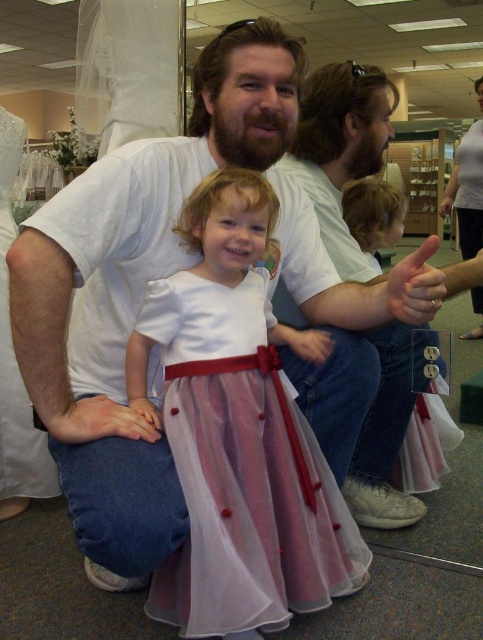
From the picture: Which of these two, pink tulle dress at center or pink matte skin at lower left, stands taller?

pink tulle dress at center

I want to click on pink tulle dress at center, so click(373, 216).

Find the location of `pink tulle dress at center`. pink tulle dress at center is located at coordinates (373, 216).

Who is taller, pink tulle dress at center or matte white hand at center?

With more height is pink tulle dress at center.

What do you see at coordinates (373, 216) in the screenshot?
I see `pink tulle dress at center` at bounding box center [373, 216].

The image size is (483, 640). What do you see at coordinates (373, 216) in the screenshot?
I see `pink tulle dress at center` at bounding box center [373, 216].

At what (x,y) coordinates should I click in order to perform the action: click on pink tulle dress at center. Please return your answer as a coordinate pair (x, y). The width and height of the screenshot is (483, 640). Looking at the image, I should click on (373, 216).

Does pastel chiffon dress at center have a larger size compared to pink tulle dress at center?

Yes.

Measure the distance from pastel chiffon dress at center to pink tulle dress at center.

pastel chiffon dress at center and pink tulle dress at center are 30.40 inches apart.

The image size is (483, 640). I want to click on pastel chiffon dress at center, so click(241, 468).

Find the location of a particular element. This screenshot has height=640, width=483. pastel chiffon dress at center is located at coordinates (241, 468).